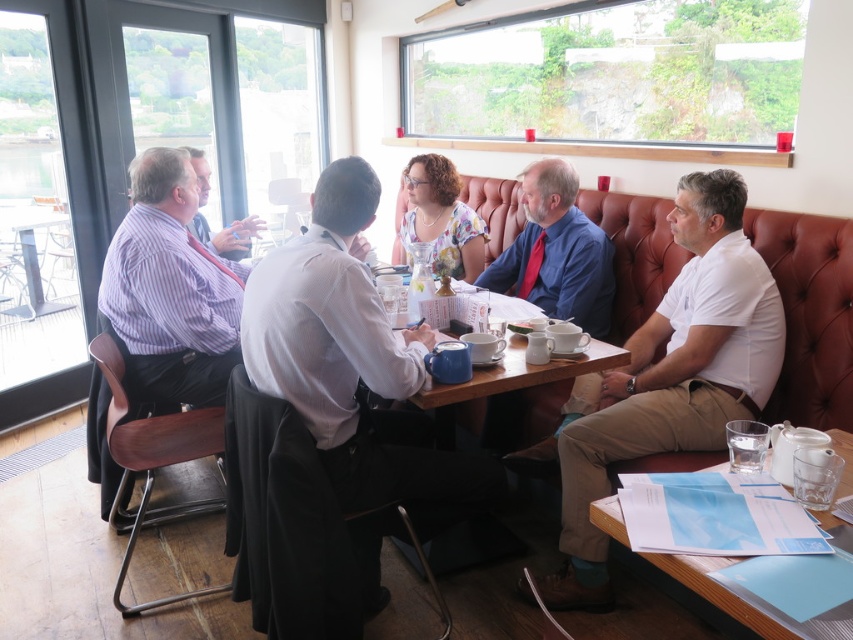
You are a customer sitting at the wooden table in the cozy cafe. You notice two points on the table surface. Which of the two points, point (676, 436) or point (764, 424), is closer to you?

Point (676, 436) is closer to you because it is further to the viewer than point (764, 424).